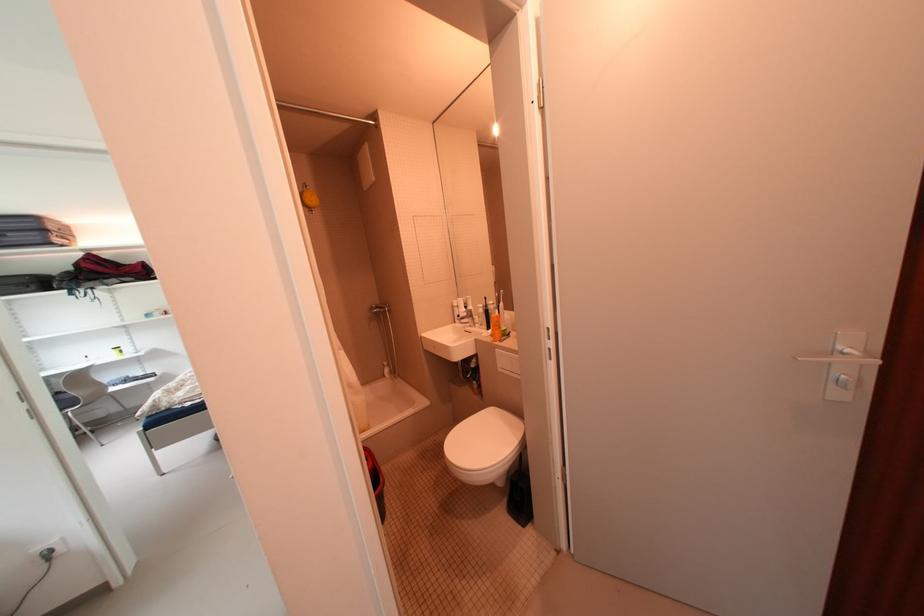
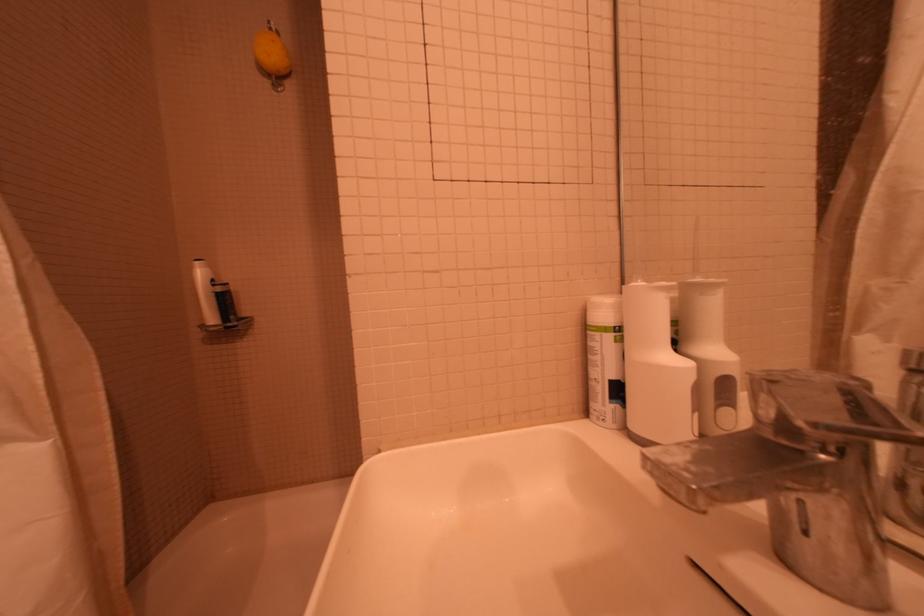
Question: Which direction would the cameraman need to move to produce the second image? Reply with the corresponding letter.

Choices:
 (A) Left
 (B) Right
 (C) Forward
 (D) Backward

Answer: (C)